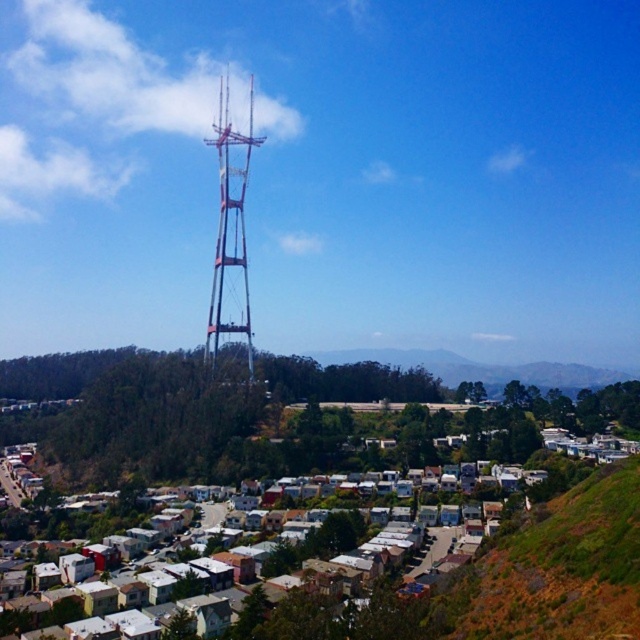
Question: Observing the image, what is the correct spatial positioning of green grassy hillside at lower right in reference to metallic silver tower at center?

Choices:
 (A) above
 (B) below

Answer: (B)

Question: Which point is closer to the camera?

Choices:
 (A) (520, 563)
 (B) (260, 141)

Answer: (A)

Question: Which point is farther to the camera?

Choices:
 (A) green grassy hillside at lower right
 (B) metallic silver tower at center

Answer: (B)

Question: Considering the relative positions of green grassy hillside at lower right and metallic silver tower at center in the image provided, where is green grassy hillside at lower right located with respect to metallic silver tower at center?

Choices:
 (A) left
 (B) right

Answer: (B)

Question: Does green grassy hillside at lower right come behind metallic silver tower at center?

Choices:
 (A) yes
 (B) no

Answer: (B)